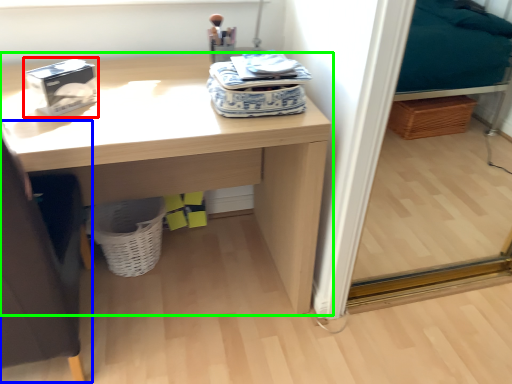
Question: Based on their relative distances, which object is farther from box (highlighted by a red box)? Choose from swivel chair (highlighted by a blue box) and desk (highlighted by a green box).

Choices:
 (A) swivel chair
 (B) desk

Answer: (A)